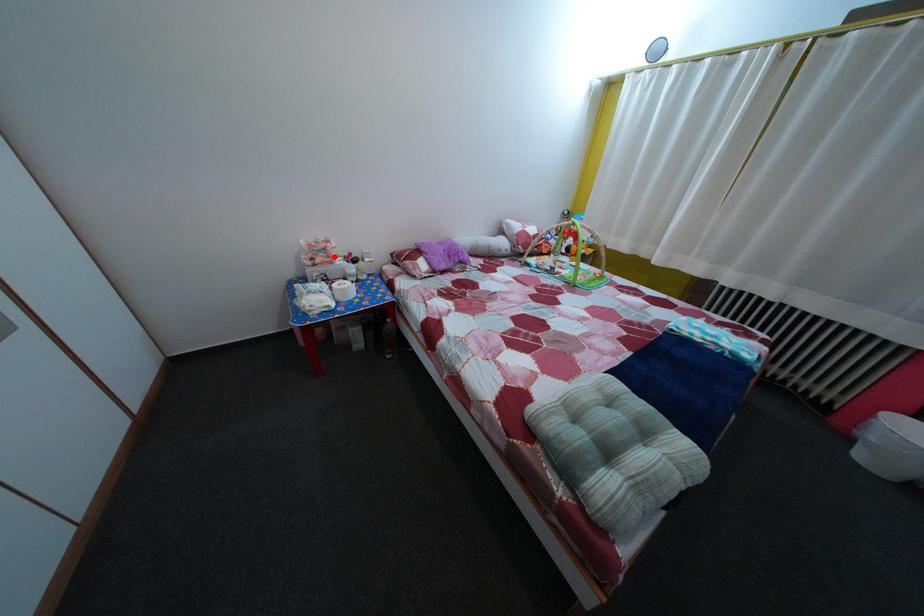
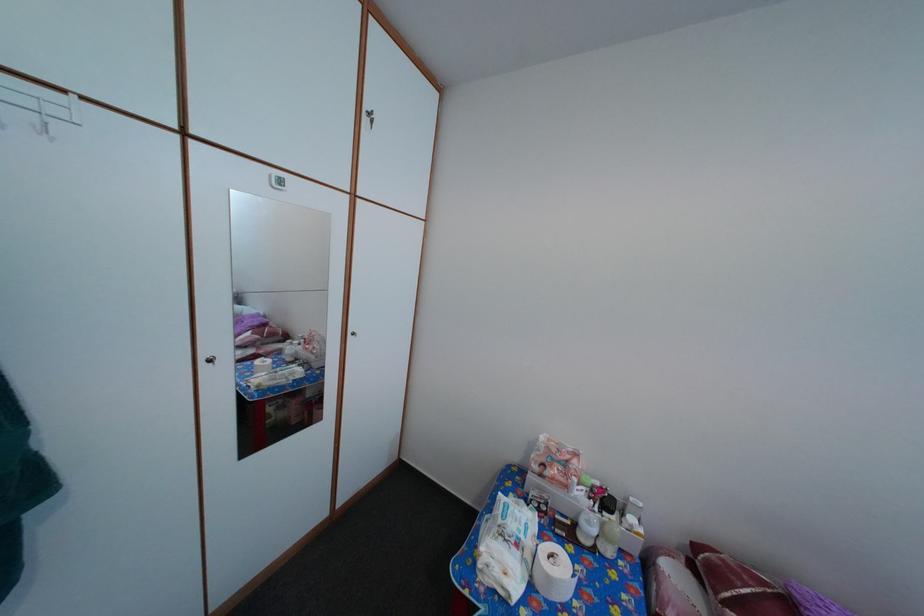
Find the pixel in the second image that matches the highlighted location in the first image.

(576, 469)